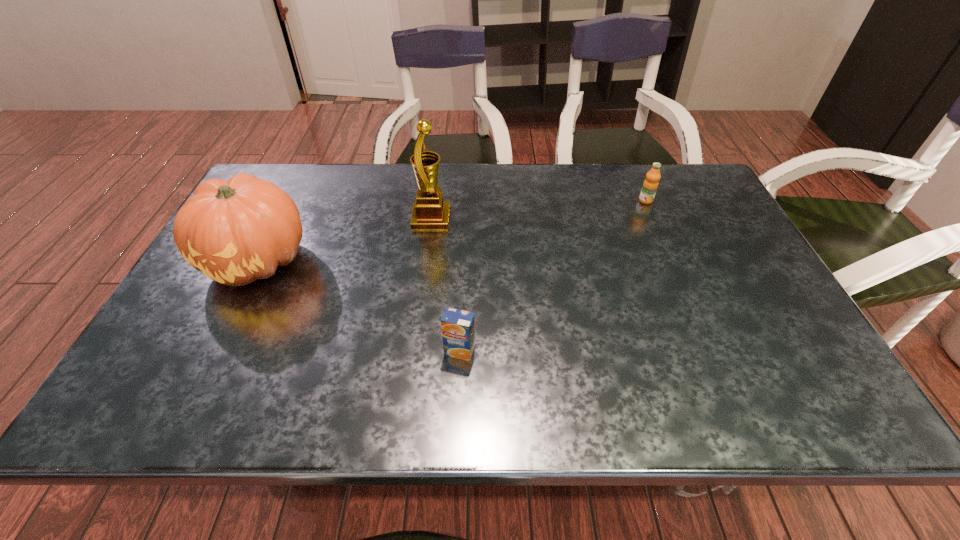
This screenshot has height=540, width=960. Identify the location of the tallest object. (430, 212).

Where is `the second object from left to right`? the second object from left to right is located at coordinates (430, 212).

Image resolution: width=960 pixels, height=540 pixels. What are the coordinates of `the third shortest object` in the screenshot? It's located at (235, 231).

Image resolution: width=960 pixels, height=540 pixels. What are the coordinates of `pumpkin` in the screenshot? It's located at (235, 231).

I want to click on the rightmost object, so click(x=650, y=185).

You are a GUI agent. You are given a task and a screenshot of the screen. Output one action in this format:
    pyautogui.click(x=<x>, y=<y>)
    Task: Click on the farther orange_juice
    Image resolution: width=960 pixels, height=540 pixels.
    Given the screenshot: What is the action you would take?
    pyautogui.click(x=650, y=185)

Where is `the nearer orange_juice`? the nearer orange_juice is located at coordinates (458, 328).

This screenshot has height=540, width=960. I want to click on the left orange_juice, so coord(458,328).

This screenshot has height=540, width=960. What are the coordinates of `vacant region located on the front-facing side of the tallest object` in the screenshot? It's located at (501, 219).

You are a GUI agent. You are given a task and a screenshot of the screen. Output one action in this format:
    pyautogui.click(x=<x>, y=<y>)
    Task: Click on the vacant position located 0.200m on the carved face of the pumpkin
    
    Given the screenshot: What is the action you would take?
    pyautogui.click(x=201, y=374)